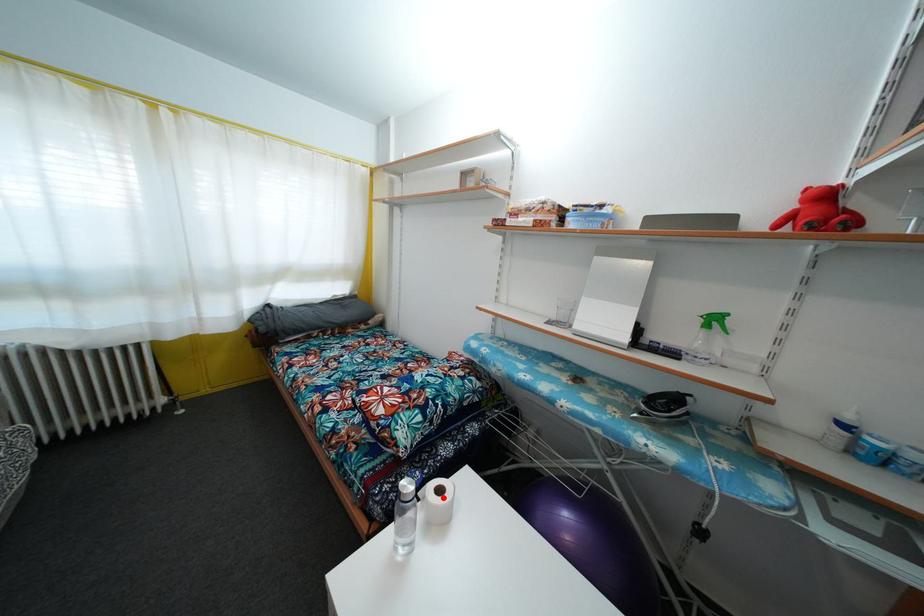
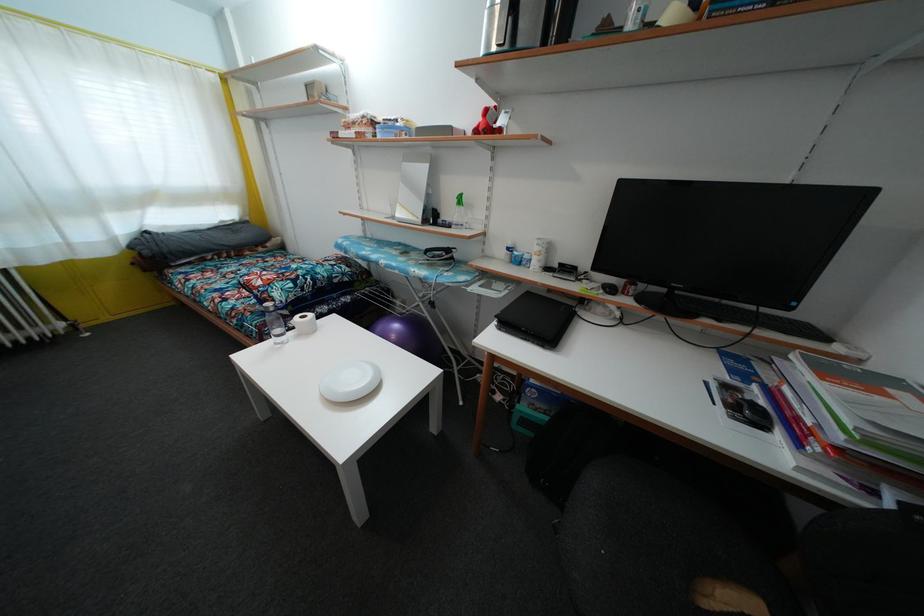
Where in the second image is the point corresponding to the highlighted location from the first image?

(307, 323)